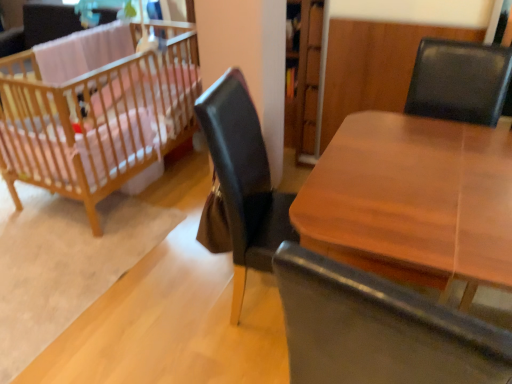
The height and width of the screenshot is (384, 512). Describe the element at coordinates (413, 202) in the screenshot. I see `wooden table at center` at that location.

In order to face wooden table at center, should I rotate leftwards or rightwards?

Rotate right and turn 21.919 degrees.

Locate an element on the screen. The width and height of the screenshot is (512, 384). wooden table at center is located at coordinates (413, 202).

Measure the distance between wooden crib at left and camera.

They are 2.05 meters apart.

Where is `wooden crib at left`? wooden crib at left is located at coordinates (96, 120).

Describe the element at coordinates (96, 120) in the screenshot. The height and width of the screenshot is (384, 512). I see `wooden crib at left` at that location.

Find the location of a particular element. Image resolution: width=512 pixels, height=384 pixels. wooden table at center is located at coordinates (413, 202).

Considering the positions of objects wooden table at center and wooden crib at left in the image provided, who is more to the right, wooden table at center or wooden crib at left?

From the viewer's perspective, wooden table at center appears more on the right side.

Is wooden table at center further to the viewer compared to wooden crib at left?

No, it is in front of wooden crib at left.

Does point (448, 190) come farther from viewer compared to point (86, 121)?

No, it is not.

From the image's perspective, is wooden table at center located above or below wooden crib at left?

Based on their image positions, wooden table at center is located beneath wooden crib at left.

From a real-world perspective, is wooden table at center physically below wooden crib at left?

Correct, in the physical world, wooden table at center is lower than wooden crib at left.

Considering the relative sizes of wooden table at center and wooden crib at left in the image provided, is wooden table at center wider than wooden crib at left?

In fact, wooden table at center might be narrower than wooden crib at left.

Is wooden table at center taller than wooden crib at left?

No.

Is wooden table at center smaller than wooden crib at left?

Indeed, wooden table at center has a smaller size compared to wooden crib at left.

In the scene shown: Would you say wooden table at center contains wooden crib at left?

No, wooden table at center does not contain wooden crib at left.

Are wooden table at center and wooden crib at left located far from each other?

Absolutely, wooden table at center is distant from wooden crib at left.

Could you tell me if wooden table at center is turned towards wooden crib at left?

No, wooden table at center is not aimed at wooden crib at left.

What's the angular difference between wooden table at center and wooden crib at left's facing directions?

wooden table at center and wooden crib at left are facing 2.72 degrees away from each other.

Locate an element on the screen. infant bed on the left of wooden table at center is located at coordinates (96, 120).

Considering the positions of objects wooden crib at left and wooden table at center in the image provided, who is more to the left, wooden crib at left or wooden table at center?

wooden crib at left.

Is wooden crib at left closer to the viewer compared to wooden table at center?

No, it is not.

Considering the positions of point (9, 159) and point (368, 267), is point (9, 159) closer or farther from the camera than point (368, 267)?

Point (9, 159) is positioned farther from the camera compared to point (368, 267).

From the image's perspective, is wooden crib at left beneath wooden table at center?

Incorrect, from the image's perspective, wooden crib at left is higher than wooden table at center.

From a real-world perspective, is wooden crib at left located higher than wooden table at center?

Indeed, from a real-world perspective, wooden crib at left stands above wooden table at center.

Is wooden crib at left thinner than wooden table at center?

In fact, wooden crib at left might be wider than wooden table at center.

From their relative heights in the image, would you say wooden crib at left is taller or shorter than wooden table at center?

Considering their sizes, wooden crib at left has more height than wooden table at center.

Looking at the image, does wooden crib at left seem bigger or smaller compared to wooden table at center?

Considering their sizes, wooden crib at left takes up more space than wooden table at center.

Is wooden crib at left surrounding wooden table at center?

Actually, wooden table at center is outside wooden crib at left.

Is there a large distance between wooden crib at left and wooden table at center?

Yes.

Is wooden crib at left aimed at wooden table at center?

No, wooden crib at left is not facing towards wooden table at center.

How many degrees apart are the facing directions of wooden crib at left and wooden table at center?

2.72 degrees separate the facing orientations of wooden crib at left and wooden table at center.

Measure the distance from wooden crib at left to wooden table at center.

A distance of 1.46 meters exists between wooden crib at left and wooden table at center.

Find the location of a particular element. table below the wooden crib at left (from the image's perspective) is located at coordinates (413, 202).

Locate an element on the screen. This screenshot has width=512, height=384. table in front of the wooden crib at left is located at coordinates (413, 202).

This screenshot has width=512, height=384. Identify the location of infant bed above the wooden table at center (from a real-world perspective). (96, 120).